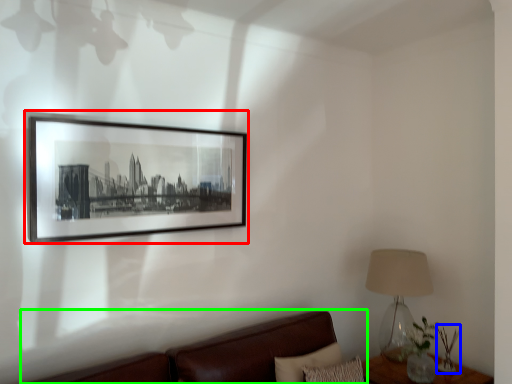
Question: Considering the real-world distances, which object is closest to picture frame (highlighted by a red box)? plant (highlighted by a blue box) or studio couch (highlighted by a green box).

Choices:
 (A) plant
 (B) studio couch

Answer: (B)